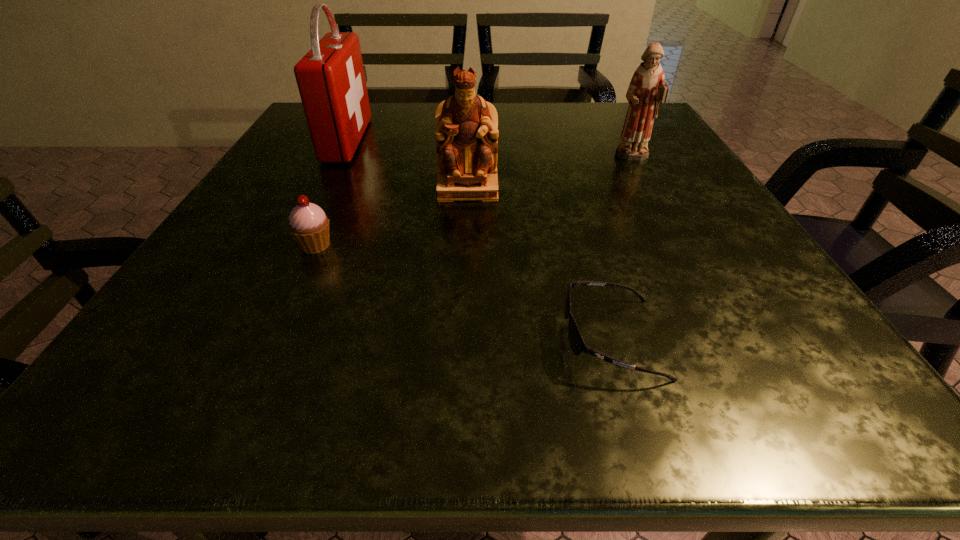
Where is `vacant space located on the front-facing side of the right figurine`? Image resolution: width=960 pixels, height=540 pixels. vacant space located on the front-facing side of the right figurine is located at coordinates (658, 205).

Identify the location of free space located on the front-facing side of the third farthest object. (467, 228).

Find the location of a particular element. This screenshot has height=540, width=960. blank area located 0.080m on the back of the cupcake is located at coordinates pos(333,207).

Image resolution: width=960 pixels, height=540 pixels. Find the location of `vacant space located on the front-facing side of the fourth object from left to right`. vacant space located on the front-facing side of the fourth object from left to right is located at coordinates (461, 338).

You are a GUI agent. You are given a task and a screenshot of the screen. Output one action in this format:
    pyautogui.click(x=<x>, y=<y>)
    Task: Click on the vacant area situated on the front-facing side of the fourth object from left to right
    
    Given the screenshot: What is the action you would take?
    pyautogui.click(x=413, y=338)

You are a GUI agent. You are given a task and a screenshot of the screen. Output one action in this format:
    pyautogui.click(x=<x>, y=<y>)
    Task: Click on the vacant space located 0.310m on the front-facing side of the fourth object from left to right
    This screenshot has width=960, height=540.
    Given the screenshot: What is the action you would take?
    pyautogui.click(x=318, y=338)

Locate an element on the screen. Image resolution: width=960 pixels, height=540 pixels. object situated at the far edge is located at coordinates (331, 80).

Locate an element on the screen. This screenshot has height=540, width=960. object present at the near edge is located at coordinates (577, 344).

Identify the location of the first-aid kit present at the left edge. The image size is (960, 540). (331, 80).

Where is `cupcake present at the left edge`? cupcake present at the left edge is located at coordinates (309, 225).